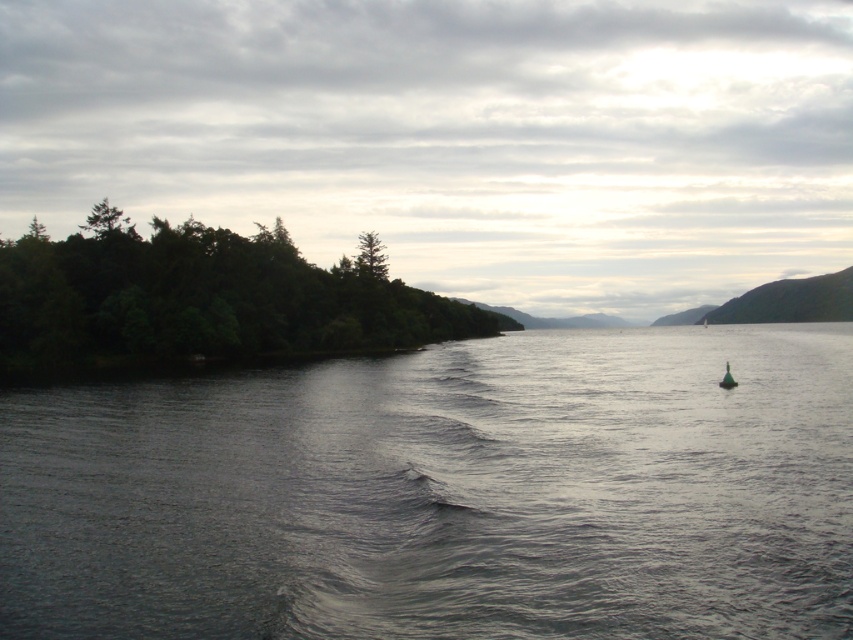
You are a photographer trying to capture the entire scene in one shot. Given that the green leafy trees at left and the green matte buoy at lower right are both in your frame, which object will appear bigger in your photo?

The green leafy trees at left will appear bigger in the photo because they are larger in size compared to the green matte buoy at lower right.

You are standing on the lakeside and want to walk from the green leafy trees at left to the green matte buoy at lower right. Which direction should you head towards?

You should head towards the right side since the green leafy trees at left is positioned on the left side of green matte buoy at lower right.

You are standing at the lakeside and want to know how far the point at coordinates [624,333] is from you. Can you determine the distance?

The distance of point [624,333] from viewer is 173.80 meters.